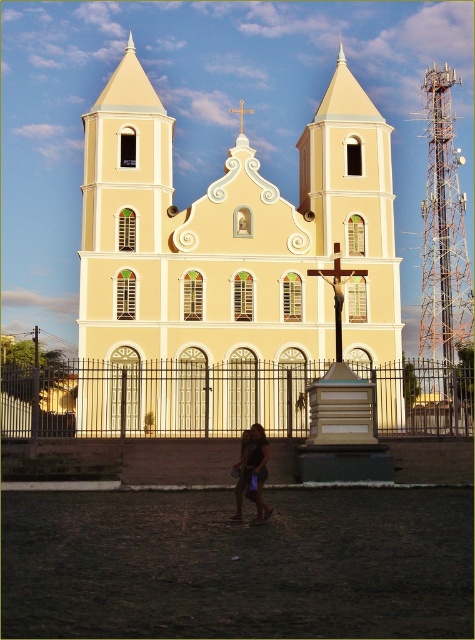
Is dark brown leather bag at lower center further to the viewer compared to gold metallic cross at center?

Result: That is False.

Where is `dark brown leather bag at lower center`? Image resolution: width=475 pixels, height=640 pixels. dark brown leather bag at lower center is located at coordinates (253, 472).

Does point (257, 492) lie behind point (248, 109)?

No, (257, 492) is closer to viewer.

This screenshot has height=640, width=475. I want to click on dark brown leather bag at lower center, so click(x=253, y=472).

Between orange metallic tower at right and gold metallic cross at center, which one is positioned lower?

Positioned lower is orange metallic tower at right.

Can you confirm if orange metallic tower at right is positioned below gold metallic cross at center?

Yes.

Is point (447, 177) closer to viewer compared to point (241, 122)?

Yes.

At what (x,y) coordinates should I click in order to perform the action: click on orange metallic tower at right. Please return your answer as a coordinate pair (x, y). The width and height of the screenshot is (475, 640). Looking at the image, I should click on (443, 230).

Which is more to the right, orange metallic tower at right or dark brown leather bag at lower center?

orange metallic tower at right

Does point (450, 372) lie behind point (249, 436)?

That is True.

Between point (427, 177) and point (262, 516), which one is positioned in front?

Point (262, 516)

Where is `orange metallic tower at right`? This screenshot has height=640, width=475. orange metallic tower at right is located at coordinates (443, 230).